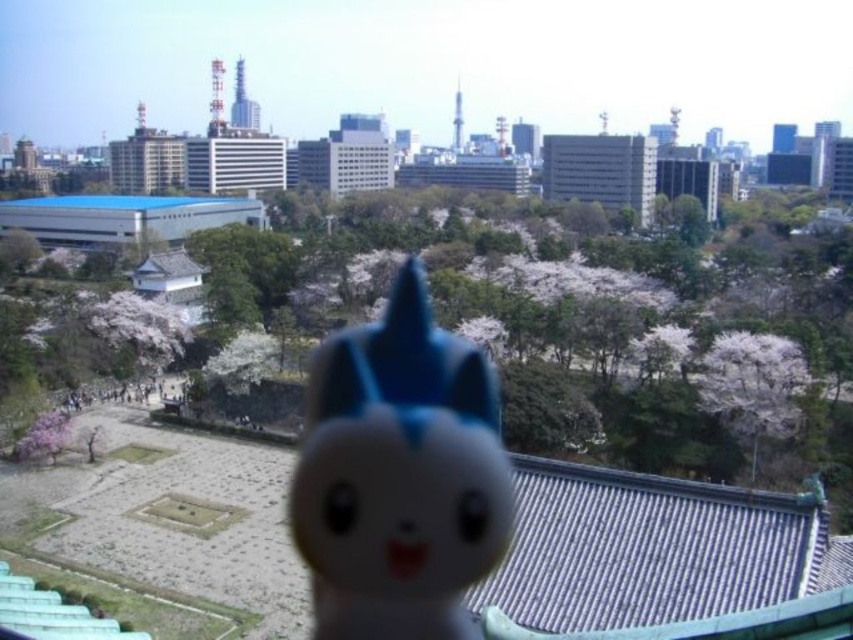
You are standing in the cityscape scene and want to take a photo. There are two points marked in the image, point 1 at coordinates point (262, 280) and point 2 at coordinates point (734, 396). Which point is closer to your camera?

Point (262, 280) is closer to the camera than point (734, 396) because it is further to the camera than the other point.

You are a photographer who wants to capture the blue matte plush toy at center and the white blossoms at center in a single shot. Which object should you focus on to ensure the other remains in the background?

The blue matte plush toy at center is closer to the camera than the white blossoms at center. To keep the white blossoms at center in the background, focus on the blue matte plush toy at center.

What is located at the coordinates point (579, 314) in the image?

The point (579, 314) corresponds to white blossoms at center.